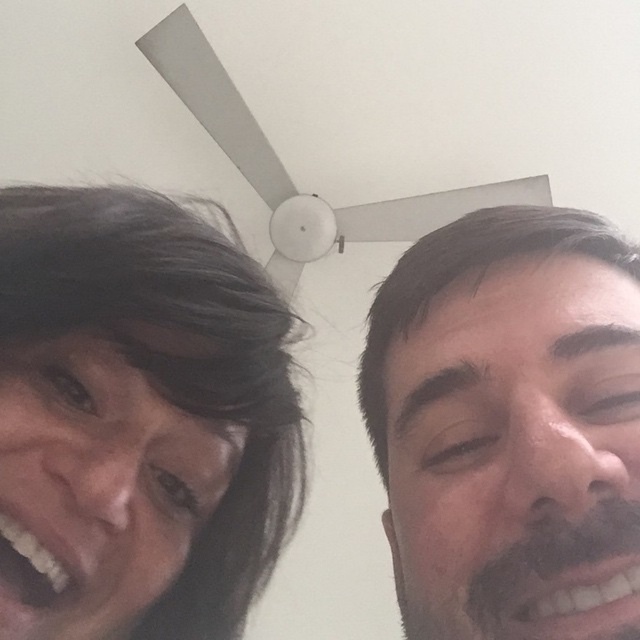
You are a photographer trying to capture a perfect selfie with two people. The two people are at point (x=464, y=557). The photographer needs to know if they can fit both people in the frame if the camera has a maximum width of 12 inches. Can you determine if both people can fit in the frame?

The two people at point (x=464, y=557) are 11.80 inches apart. Since the distance between them is less than the camera frame width of 12 inches, both people can fit in the frame.

You are a photographer trying to focus on the smooth skin face at right in the image. However, the matte black hair at upper center is blocking your view. Can you adjust your camera to focus on the face without moving any objects?

The matte black hair at upper center is in front of the smooth skin face at right, so you would need to adjust the camera focus to a closer range or reposition the camera angle to bypass the obstruction caused by the hair.

Based on the photo, you are a photographer trying to capture a group photo of two people. You notice the dark brown hair at left and the smooth skin face at right in the frame. Which person should you adjust their position to ensure their faces are centered in the photo?

The dark brown hair at left is positioned on the left side of smooth skin face at right, so you should move the person with the dark brown hair at left to the right to align their faces more centrally.